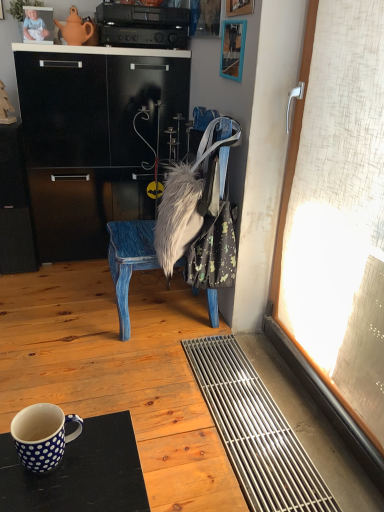
Question: Considering their positions, is fuzzy white fur at center located in front of or behind brushed metal picture frame at upper center, positioned as the 3th picture frame in bottom-to-top order?

Choices:
 (A) behind
 (B) front

Answer: (B)

Question: Based on their positions, is fuzzy white fur at center located to the left or right of brushed metal picture frame at upper center, the first picture frame in the left-to-right sequence?

Choices:
 (A) right
 (B) left

Answer: (A)

Question: Which object is the closest to the wooden picture frame at upper center, the 1th picture frame when ordered from front to back?

Choices:
 (A) white polka dot ceramic mug at lower left
 (B) wooden picture frame at upper right, the first picture frame when ordered from bottom to top
 (C) fuzzy white fur at center
 (D) light blue fabric baby at upper left
 (E) fuzzy fabric bag at center

Answer: (B)

Question: Based on their relative distances, which object is farther from the blue painted wood chair at center?

Choices:
 (A) wooden picture frame at upper right, arranged as the 2th picture frame when viewed from the right
 (B) black plastic stereo at upper center
 (C) light blue fabric baby at upper left
 (D) matte clay teapot at upper left
 (E) brushed metal picture frame at upper center, which ranks as the 1th picture frame in top-to-bottom order

Answer: (E)